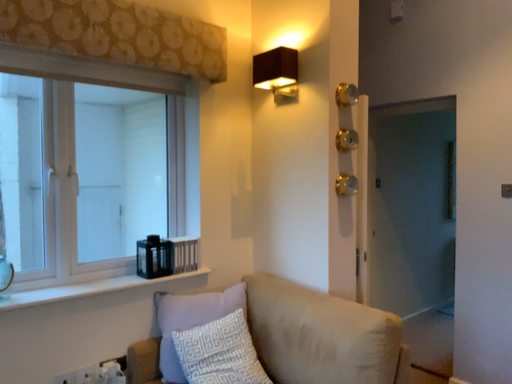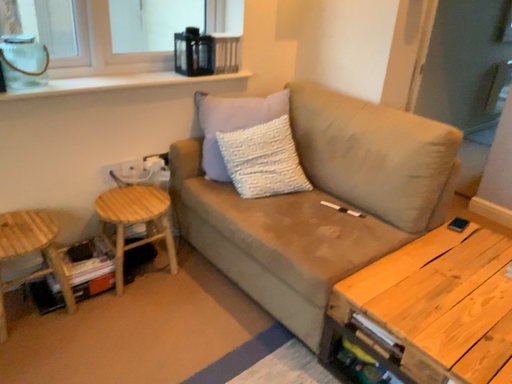
Question: How did the camera likely rotate when shooting the video?

Choices:
 (A) rotated downward
 (B) rotated upward

Answer: (A)